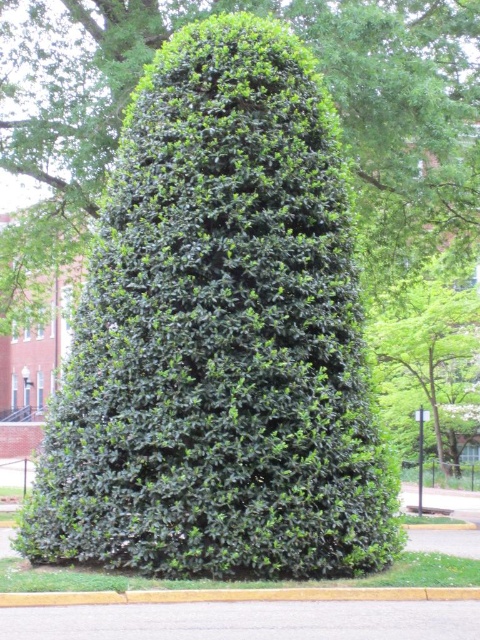
Question: Does green leafy hedge at center appear under yellow asphalt curb at lower center?

Choices:
 (A) no
 (B) yes

Answer: (A)

Question: Can you confirm if green leafy hedge at center is smaller than yellow asphalt curb at lower center?

Choices:
 (A) yes
 (B) no

Answer: (B)

Question: In this image, where is green leafy hedge at center located relative to yellow asphalt curb at lower center?

Choices:
 (A) left
 (B) right

Answer: (A)

Question: Which object appears farthest from the camera in this image?

Choices:
 (A) yellow asphalt curb at lower center
 (B) green leafy hedge at center

Answer: (B)